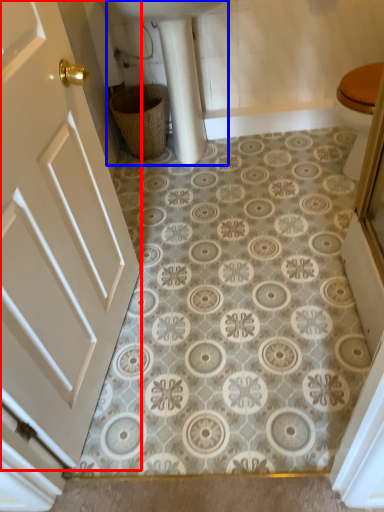
Question: Which object appears closest to the camera in this image, door (highlighted by a red box) or sink (highlighted by a blue box)?

Choices:
 (A) door
 (B) sink

Answer: (A)